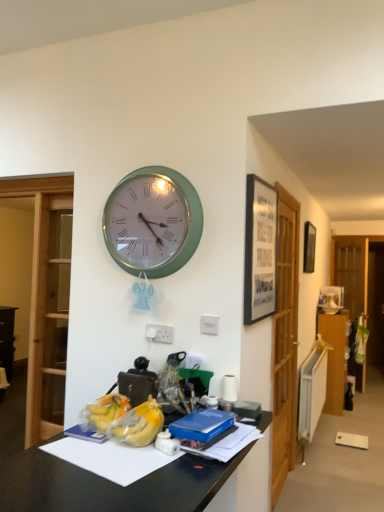
Question: Is matte black picture frame at upper right, which is the first picture frame in right-to-left order, taller or shorter than wooden dresser at right?

Choices:
 (A) tall
 (B) short

Answer: (B)

Question: Is point (306, 269) positioned closer to the camera than point (329, 374)?

Choices:
 (A) farther
 (B) closer

Answer: (B)

Question: Estimate the real-world distances between objects in this image. Which object is farther from the transparent wooden door at right, which is the 1th glass door in back-to-front order?

Choices:
 (A) matte black picture frame at upper right, which is the first picture frame in right-to-left order
 (B) blue matte book at center
 (C) black glossy desk at lower center
 (D) wooden glass door at center, which is the 1th glass door from front to back
 (E) black matte picture frame at upper right, which is the second picture frame in right-to-left order

Answer: (C)

Question: Based on their relative distances, which object is farther from the black glossy desk at lower center?

Choices:
 (A) green metallic wall clock at upper center
 (B) black matte picture frame at upper right, which is the second picture frame in right-to-left order
 (C) translucent plastic bananas at center
 (D) transparent wooden door at right, positioned as the second glass door in left-to-right order
 (E) blue matte book at center

Answer: (D)